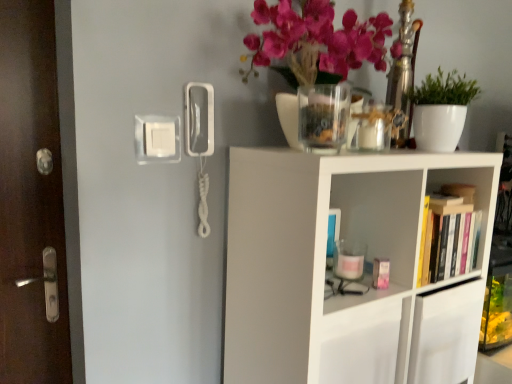
Question: Should I look upward or downward to see white matte plant at upper right?

Choices:
 (A) up
 (B) down

Answer: (A)

Question: Is transparent glass jar at upper center not within white matte shelf at upper right?

Choices:
 (A) yes
 (B) no

Answer: (A)

Question: From the image's perspective, does transparent glass jar at upper center appear higher than white matte shelf at upper right?

Choices:
 (A) no
 (B) yes

Answer: (B)

Question: Are transparent glass jar at upper center and white matte shelf at upper right far apart?

Choices:
 (A) yes
 (B) no

Answer: (B)

Question: Can you confirm if transparent glass jar at upper center is wider than white matte shelf at upper right?

Choices:
 (A) yes
 (B) no

Answer: (B)

Question: Does transparent glass jar at upper center have a smaller size compared to white matte shelf at upper right?

Choices:
 (A) no
 (B) yes

Answer: (B)

Question: Is transparent glass jar at upper center to the left of white matte shelf at upper right from the viewer's perspective?

Choices:
 (A) yes
 (B) no

Answer: (A)

Question: Is hardcover book at right bigger than transparent glass jar at upper center?

Choices:
 (A) no
 (B) yes

Answer: (B)

Question: Is hardcover book at right wider than transparent glass jar at upper center?

Choices:
 (A) no
 (B) yes

Answer: (A)

Question: From the image's perspective, would you say hardcover book at right is positioned over transparent glass jar at upper center?

Choices:
 (A) no
 (B) yes

Answer: (A)

Question: Is hardcover book at right facing away from transparent glass jar at upper center?

Choices:
 (A) yes
 (B) no

Answer: (B)

Question: Considering the relative positions of hardcover book at right and transparent glass jar at upper center in the image provided, is hardcover book at right behind transparent glass jar at upper center?

Choices:
 (A) yes
 (B) no

Answer: (A)

Question: Is hardcover book at right not within transparent glass jar at upper center?

Choices:
 (A) yes
 (B) no

Answer: (A)

Question: Is hardcover book at right shorter than brown wooden door at left?

Choices:
 (A) no
 (B) yes

Answer: (B)